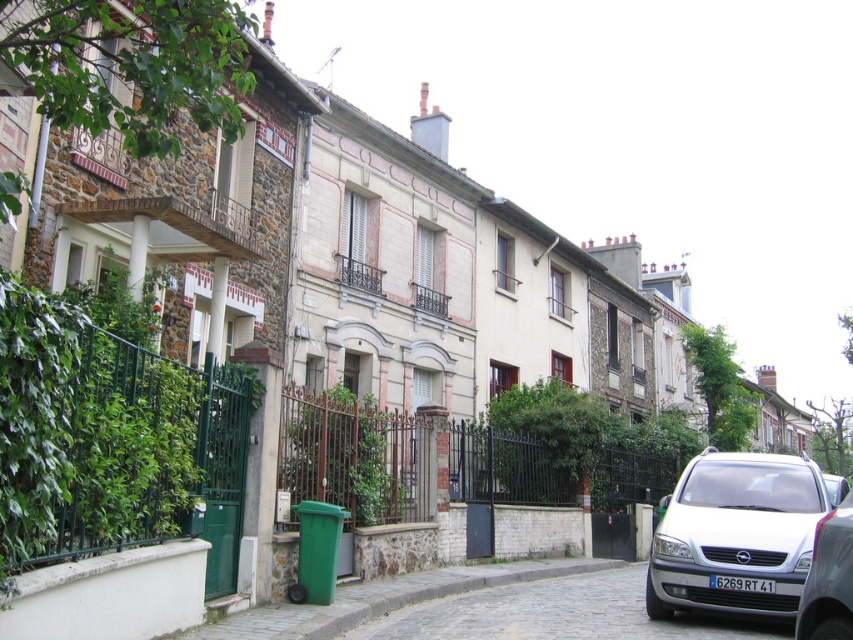
Question: Is white matte van at lower right closer to camera compared to silver metallic van at right?

Choices:
 (A) yes
 (B) no

Answer: (B)

Question: Is white matte van at lower right bigger than silver metallic van at right?

Choices:
 (A) no
 (B) yes

Answer: (B)

Question: Is white matte van at lower right positioned in front of silver metallic van at right?

Choices:
 (A) no
 (B) yes

Answer: (A)

Question: Which of the following is the closest to the observer?

Choices:
 (A) white matte van at lower right
 (B) silver metallic van at right

Answer: (B)